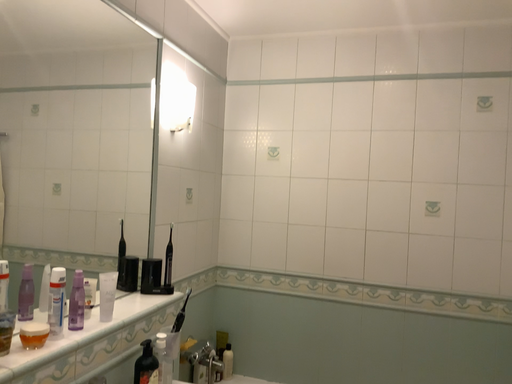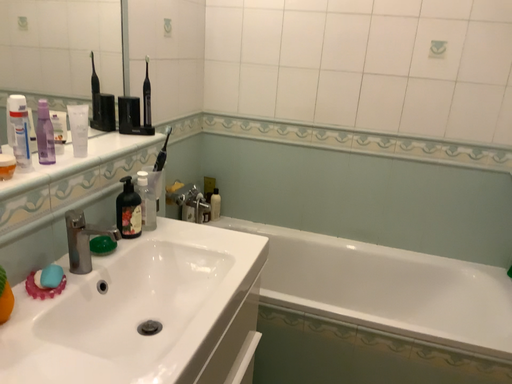
Question: Which way did the camera rotate in the video?

Choices:
 (A) rotated upward
 (B) rotated downward

Answer: (B)